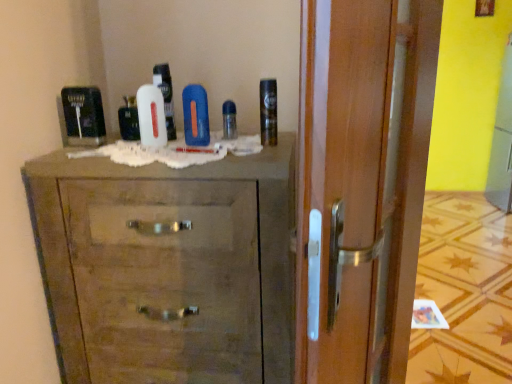
Question: Is white matte shaving cream at center, which is the first shaving cream from left to right, outside shiny metallic can at upper right, positioned as the 3th shaving cream in left-to-right order?

Choices:
 (A) no
 (B) yes

Answer: (B)

Question: Does white matte shaving cream at center, acting as the third shaving cream starting from the right, have a greater width compared to shiny metallic can at upper right, positioned as the 3th shaving cream in left-to-right order?

Choices:
 (A) yes
 (B) no

Answer: (A)

Question: From the image's perspective, is white matte shaving cream at center, which is the first shaving cream from left to right, under shiny metallic can at upper right, marked as the first shaving cream in a right-to-left arrangement?

Choices:
 (A) yes
 (B) no

Answer: (A)

Question: Is white matte shaving cream at center, acting as the third shaving cream starting from the right, turned away from shiny metallic can at upper right, positioned as the 3th shaving cream in left-to-right order?

Choices:
 (A) no
 (B) yes

Answer: (A)

Question: From a real-world perspective, is white matte shaving cream at center, which is the first shaving cream from left to right, physically below shiny metallic can at upper right, marked as the first shaving cream in a right-to-left arrangement?

Choices:
 (A) no
 (B) yes

Answer: (B)

Question: From the image's perspective, is wooden chest of drawers at center located above or below blue matte bottle at center?

Choices:
 (A) above
 (B) below

Answer: (B)

Question: Is wooden chest of drawers at center bigger or smaller than blue matte bottle at center?

Choices:
 (A) small
 (B) big

Answer: (B)

Question: Is wooden chest of drawers at center wider or thinner than blue matte bottle at center?

Choices:
 (A) wide
 (B) thin

Answer: (A)

Question: Considering the relative positions of wooden chest of drawers at center and blue matte bottle at center in the image provided, is wooden chest of drawers at center to the left or to the right of blue matte bottle at center?

Choices:
 (A) right
 (B) left

Answer: (B)

Question: Is point (125, 132) closer or farther from the camera than point (170, 114)?

Choices:
 (A) farther
 (B) closer

Answer: (A)

Question: In the image, is white glossy mouthwash at center, which is the 2th mouthwash from right to left, positioned in front of or behind white matte shaving cream at center, the 2th shaving cream positioned from the right?

Choices:
 (A) front
 (B) behind

Answer: (B)

Question: From the image's perspective, is white glossy mouthwash at center, placed as the 1th mouthwash when sorted from left to right, positioned above or below white matte shaving cream at center, the second shaving cream in the left-to-right sequence?

Choices:
 (A) above
 (B) below

Answer: (B)

Question: Is white glossy mouthwash at center, which is the 2th mouthwash from right to left, bigger or smaller than white matte shaving cream at center, the 2th shaving cream positioned from the right?

Choices:
 (A) big
 (B) small

Answer: (B)

Question: Do you think blue matte bottle at center is within shiny metallic can at upper right, positioned as the 3th shaving cream in left-to-right order, or outside of it?

Choices:
 (A) outside
 (B) inside

Answer: (A)

Question: Looking at their shapes, would you say blue matte bottle at center is wider or thinner than shiny metallic can at upper right, marked as the first shaving cream in a right-to-left arrangement?

Choices:
 (A) thin
 (B) wide

Answer: (B)